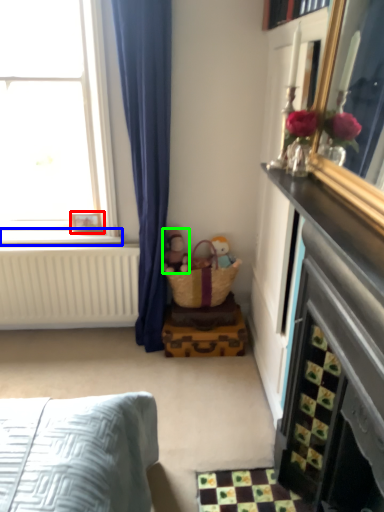
Question: Considering the real-world distances, which object is farthest from picture frame (highlighted by a red box)? window sill (highlighted by a blue box) or doll (highlighted by a green box)?

Choices:
 (A) window sill
 (B) doll

Answer: (B)